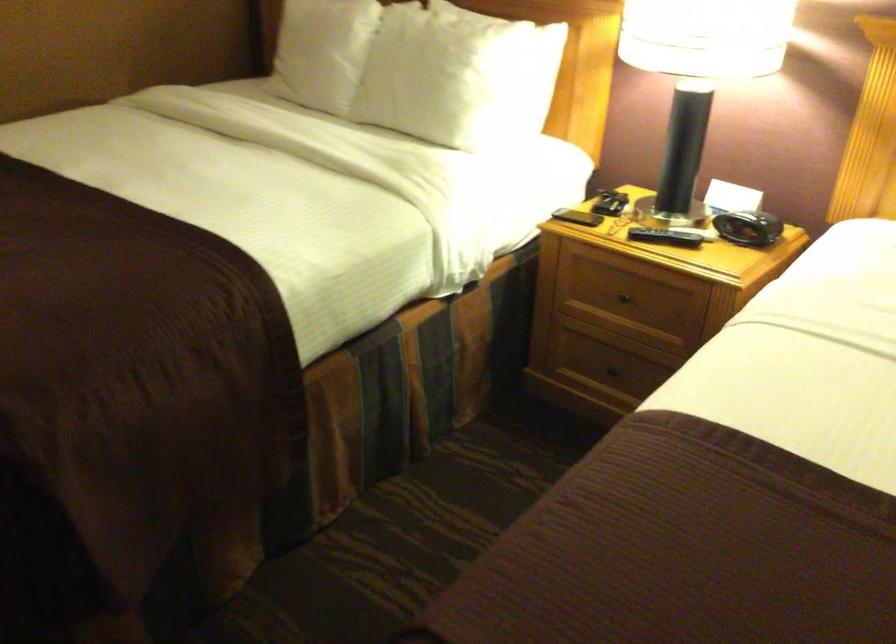
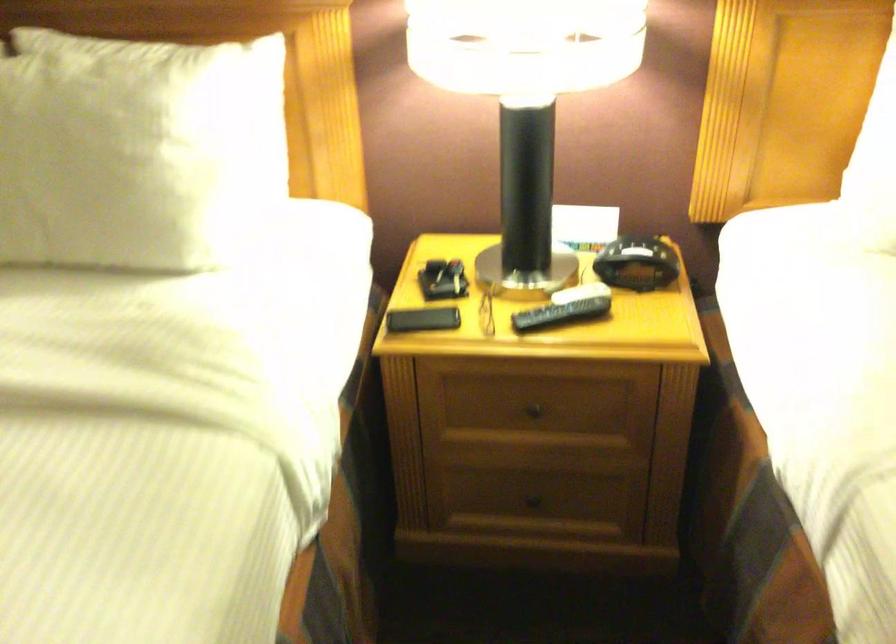
The point at (690, 234) is marked in the first image. Where is the corresponding point in the second image?

(579, 292)